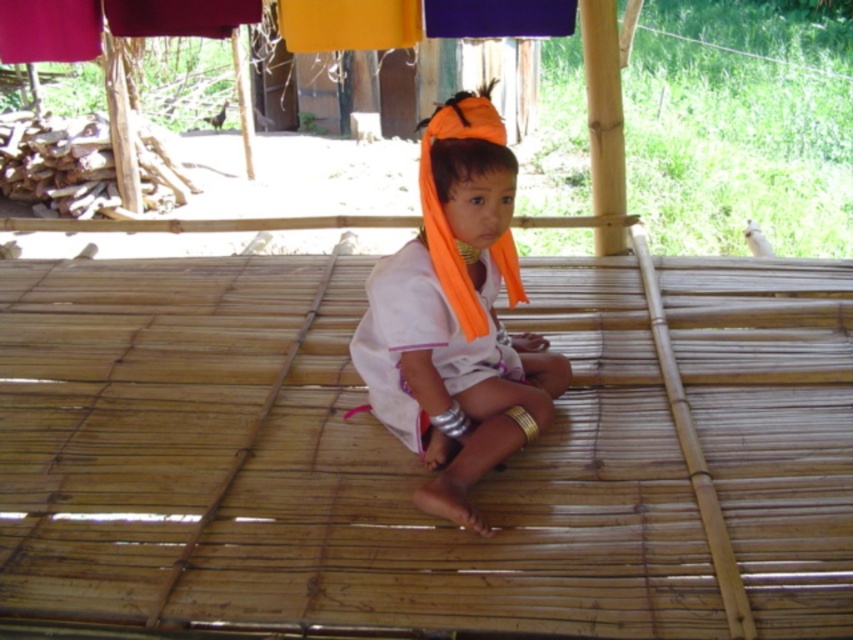
Can you confirm if orange fabric headband at center is positioned to the right of white cotton robe at center?

Indeed, orange fabric headband at center is positioned on the right side of white cotton robe at center.

Between orange fabric headband at center and white cotton robe at center, which one appears on the left side from the viewer's perspective?

From the viewer's perspective, white cotton robe at center appears more on the left side.

Which is behind, point (479, 392) or point (416, 259)?

The point (479, 392) is more distant.

The image size is (853, 640). I want to click on orange fabric headband at center, so click(456, 317).